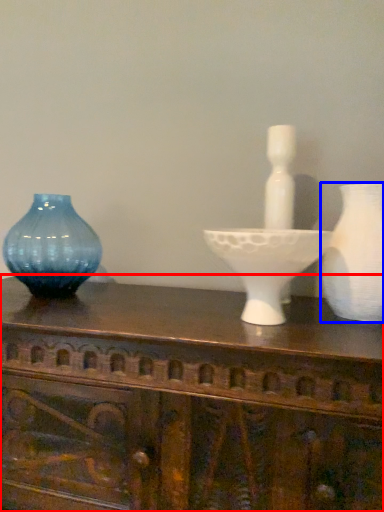
Question: Which point is further to the camera, table (highlighted by a red box) or vase (highlighted by a blue box)?

Choices:
 (A) table
 (B) vase

Answer: (B)